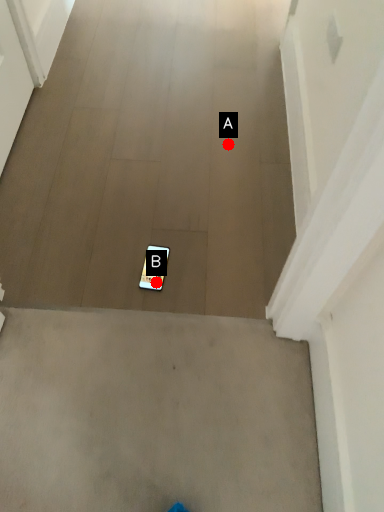
Question: Two points are circled on the image, labeled by A and B beside each circle. Which point appears closest to the camera in this image?

Choices:
 (A) A is closer
 (B) B is closer

Answer: (B)